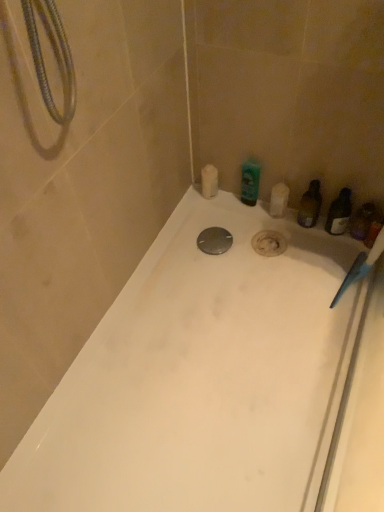
Image resolution: width=384 pixels, height=512 pixels. I want to click on vacant area that lies between green glossy bottle at upper right, acting as the 3th toiletry starting from the right, and metallic silver drain at center, so click(x=233, y=225).